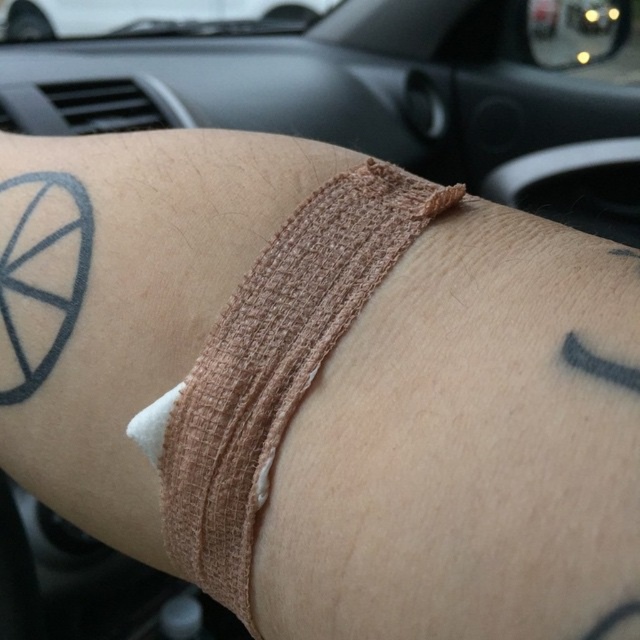
Is point (195, 451) farther from viewer compared to point (172, 29)?

No, it is in front of (172, 29).

Between beige fabric bandage at center and white matte car at upper center, which one is positioned higher?

Positioned higher is white matte car at upper center.

Which is in front, point (250, 497) or point (177, 13)?

Point (250, 497)

The height and width of the screenshot is (640, 640). In order to click on beige fabric bandage at center in this screenshot , I will do `click(273, 365)`.